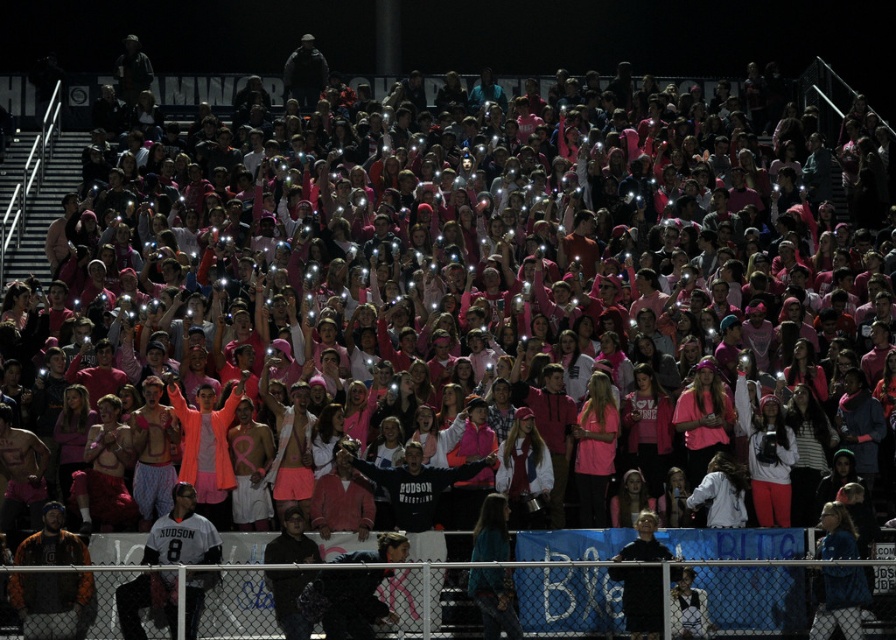
Question: Considering the relative positions of orange leather jacket at lower left and black matte jacket at lower center in the image provided, where is orange leather jacket at lower left located with respect to black matte jacket at lower center?

Choices:
 (A) right
 (B) left

Answer: (B)

Question: Among these points, which one is farthest from the camera?

Choices:
 (A) (132, 628)
 (B) (19, 586)

Answer: (A)

Question: Which point is farther to the camera?

Choices:
 (A) white jersey at lower left
 (B) black matte jacket at lower center

Answer: (B)

Question: In this image, where is white jersey at lower left located relative to black matte jacket at lower center?

Choices:
 (A) left
 (B) right

Answer: (A)

Question: Is white jersey at lower left smaller than orange leather jacket at lower left?

Choices:
 (A) no
 (B) yes

Answer: (B)

Question: Which of the following is the farthest from the observer?

Choices:
 (A) (48, 504)
 (B) (191, 636)
 (C) (648, 605)

Answer: (A)